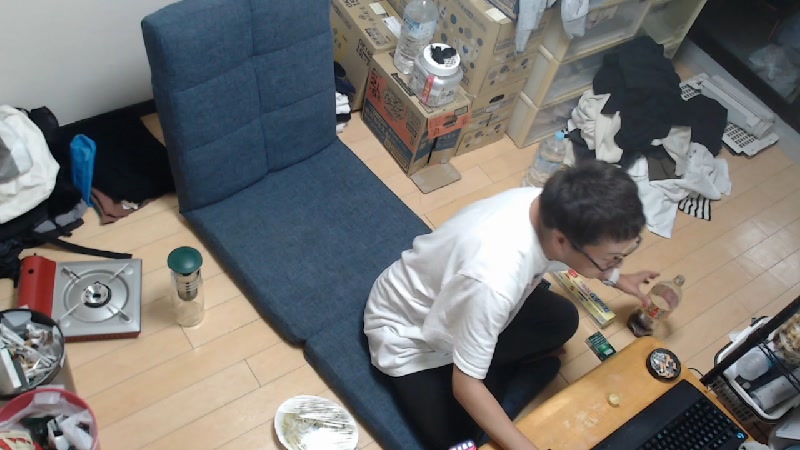
I want to click on back support, so click(260, 122).